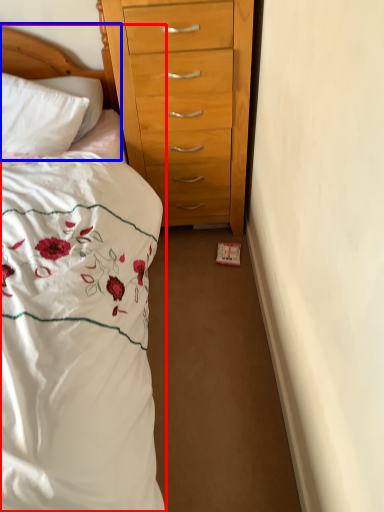
Question: Among these objects, which one is nearest to the camera, bed (highlighted by a red box) or headboard (highlighted by a blue box)?

Choices:
 (A) bed
 (B) headboard

Answer: (A)